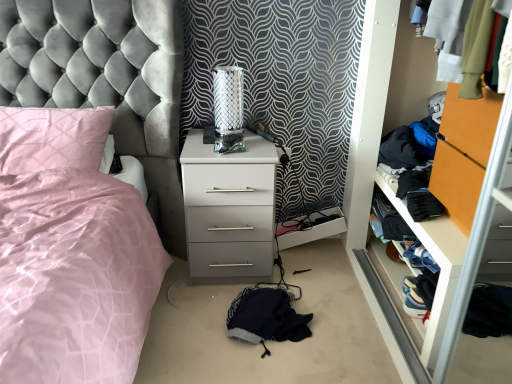
Locate an element on the screen. Image resolution: width=512 pixels, height=384 pixels. empty space that is in between white glossy chest of drawers at center and fuzzy dark blue blanket at lower center, the first clothing when ordered from left to right is located at coordinates (222, 303).